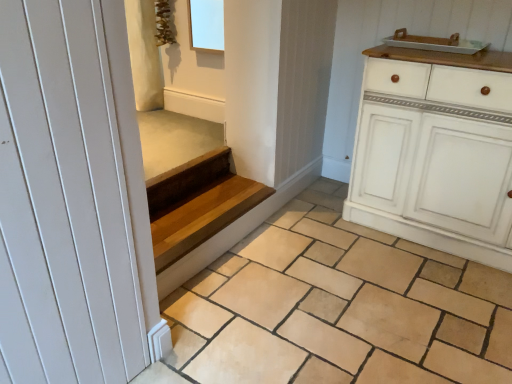
Question: Is white ceramic tray at upper right behind white painted wood cabinet at right?

Choices:
 (A) no
 (B) yes

Answer: (B)

Question: Are white ceramic tray at upper right and white painted wood cabinet at right making contact?

Choices:
 (A) yes
 (B) no

Answer: (B)

Question: Would you say white ceramic tray at upper right is outside white painted wood cabinet at right?

Choices:
 (A) no
 (B) yes

Answer: (B)

Question: Does white ceramic tray at upper right have a larger size compared to white painted wood cabinet at right?

Choices:
 (A) yes
 (B) no

Answer: (B)

Question: Is white ceramic tray at upper right surrounding white painted wood cabinet at right?

Choices:
 (A) no
 (B) yes

Answer: (A)

Question: Considering the relative sizes of white ceramic tray at upper right and white painted wood cabinet at right in the image provided, is white ceramic tray at upper right thinner than white painted wood cabinet at right?

Choices:
 (A) no
 (B) yes

Answer: (B)

Question: Can you confirm if white painted wood cabinet at right is wider than wooden stairs at center?

Choices:
 (A) yes
 (B) no

Answer: (A)

Question: Is white painted wood cabinet at right at the right side of wooden stairs at center?

Choices:
 (A) yes
 (B) no

Answer: (A)

Question: Does white painted wood cabinet at right have a lesser height compared to wooden stairs at center?

Choices:
 (A) yes
 (B) no

Answer: (B)

Question: Can you confirm if white painted wood cabinet at right is bigger than wooden stairs at center?

Choices:
 (A) yes
 (B) no

Answer: (A)

Question: Is white painted wood cabinet at right closer to the viewer compared to wooden stairs at center?

Choices:
 (A) no
 (B) yes

Answer: (B)

Question: Is white painted wood cabinet at right positioned behind wooden stairs at center?

Choices:
 (A) no
 (B) yes

Answer: (A)

Question: Considering the relative positions of natural stone tile at center and wooden stairs at center in the image provided, is natural stone tile at center to the right of wooden stairs at center from the viewer's perspective?

Choices:
 (A) yes
 (B) no

Answer: (A)